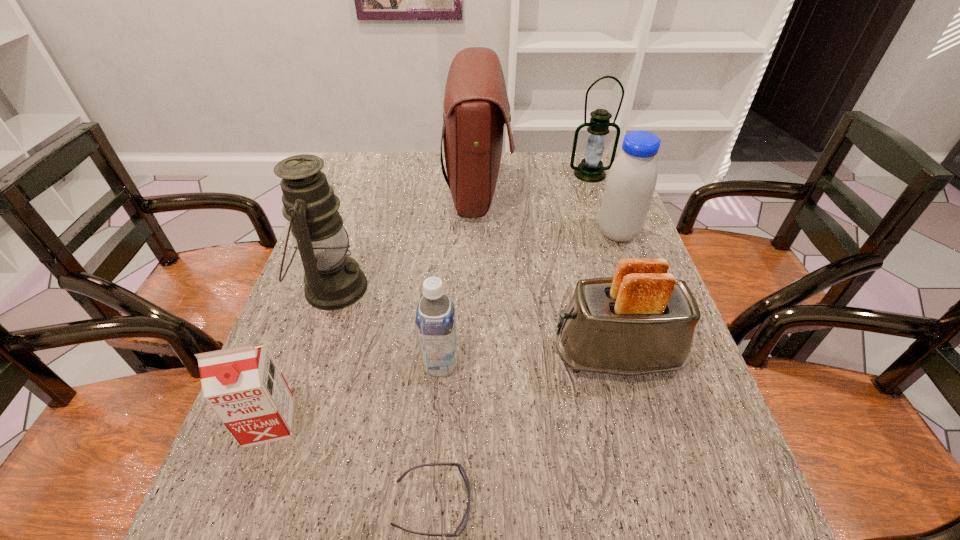
You are a GUI agent. You are given a task and a screenshot of the screen. Output one action in this format:
    pyautogui.click(x=<x>, y=<y>)
    Task: Click on the free point at the far right corner
    This screenshot has height=540, width=960.
    Given the screenshot: What is the action you would take?
    pyautogui.click(x=569, y=186)

Where is `free spot between the second soya milk from left to right and the lantern`? The image size is (960, 540). free spot between the second soya milk from left to right and the lantern is located at coordinates pos(516,269).

Find the location of a particular element. The width and height of the screenshot is (960, 540). free space between the satchel and the toaster is located at coordinates (547, 273).

Locate an element on the screen. free point between the oil lamp and the farthest soya milk is located at coordinates (475, 260).

Where is `vacant area that lies between the oil lamp and the second nearest object`? This screenshot has height=540, width=960. vacant area that lies between the oil lamp and the second nearest object is located at coordinates (301, 355).

Where is `free space that is in between the satchel and the oil lamp`? The width and height of the screenshot is (960, 540). free space that is in between the satchel and the oil lamp is located at coordinates (405, 239).

Choose which object is the nearest neighbor to the second soya milk from left to right. Please provide its 2D coordinates. Your answer should be formatted as a tuple, i.e. [(x, y)], where the tuple contains the x and y coordinates of a point satisfying the conditions above.

[(333, 280)]

Where is `object that stands as the second closest to the second farthest soya milk`? This screenshot has width=960, height=540. object that stands as the second closest to the second farthest soya milk is located at coordinates (464, 521).

Locate an element on the screen. Image resolution: width=960 pixels, height=540 pixels. soya milk that is the closest one to the rightmost soya milk is located at coordinates (435, 318).

Identify which soya milk is the closest to the fourth farthest object. Please provide its 2D coordinates. Your answer should be formatted as a tuple, i.e. [(x, y)], where the tuple contains the x and y coordinates of a point satisfying the conditions above.

[(435, 318)]